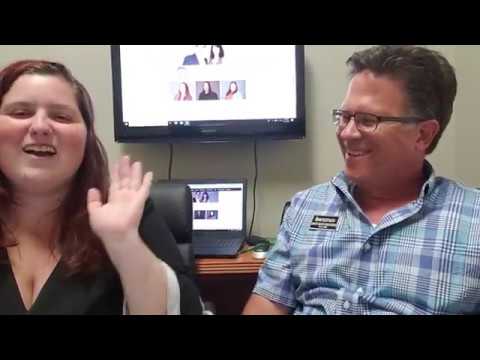
I want to click on brown desk, so click(x=244, y=266).